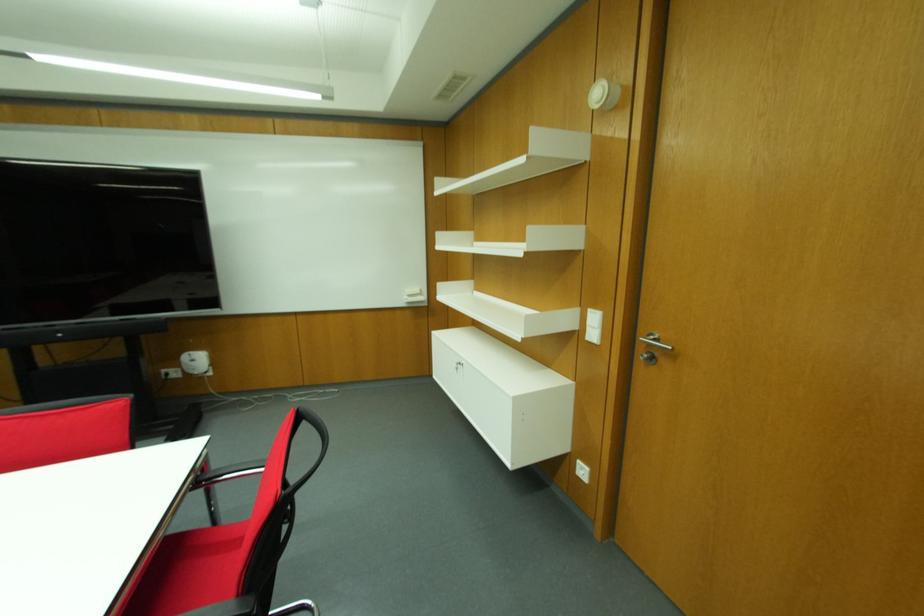
I want to click on black chair armrest, so click(226, 475).